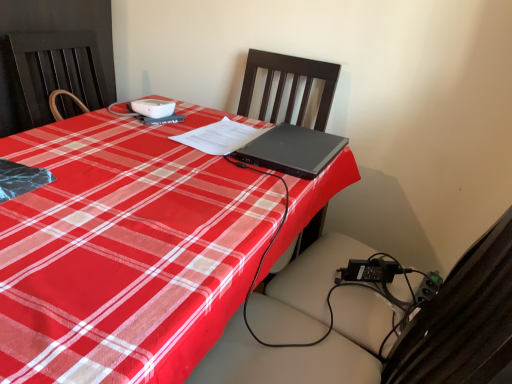
Question: Is black plastic swivel chair at center to the right of black wood chair at center from the viewer's perspective?

Choices:
 (A) no
 (B) yes

Answer: (B)

Question: Is black wood chair at center inside black plastic swivel chair at center?

Choices:
 (A) no
 (B) yes

Answer: (A)

Question: Does black plastic swivel chair at center lie behind black wood chair at center?

Choices:
 (A) no
 (B) yes

Answer: (A)

Question: Is black plastic swivel chair at center taller than black wood chair at center?

Choices:
 (A) no
 (B) yes

Answer: (B)

Question: Can you confirm if black plastic swivel chair at center is positioned to the left of black wood chair at center?

Choices:
 (A) yes
 (B) no

Answer: (B)

Question: Is black wood chair at center in front of or behind black matte laptop at center in the image?

Choices:
 (A) front
 (B) behind

Answer: (A)

Question: Do you think black wood chair at center is within black matte laptop at center, or outside of it?

Choices:
 (A) outside
 (B) inside

Answer: (A)

Question: Considering the positions of black wood chair at center and black matte laptop at center in the image, is black wood chair at center taller or shorter than black matte laptop at center?

Choices:
 (A) short
 (B) tall

Answer: (B)

Question: From the image's perspective, relative to black matte laptop at center, is black wood chair at center above or below?

Choices:
 (A) below
 (B) above

Answer: (B)

Question: Is black matte laptop at center in front of or behind black wood chair at center in the image?

Choices:
 (A) behind
 (B) front

Answer: (A)

Question: From a real-world perspective, is black matte laptop at center above or below black wood chair at center?

Choices:
 (A) above
 (B) below

Answer: (A)

Question: Is black matte laptop at center wider or thinner than black wood chair at center?

Choices:
 (A) wide
 (B) thin

Answer: (B)

Question: Considering the relative positions of black matte laptop at center and black wood chair at center in the image provided, is black matte laptop at center to the left or to the right of black wood chair at center?

Choices:
 (A) right
 (B) left

Answer: (A)

Question: In the image, is black plastic swivel chair at center positioned in front of or behind black wood chair at center?

Choices:
 (A) behind
 (B) front

Answer: (B)

Question: From the image's perspective, relative to black wood chair at center, is black plastic swivel chair at center above or below?

Choices:
 (A) above
 (B) below

Answer: (B)